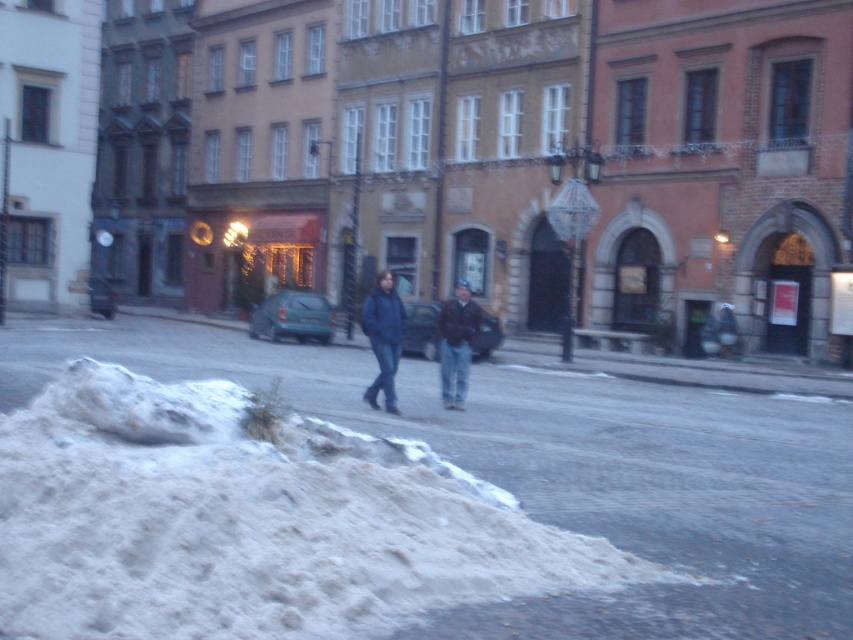
Is matte blue jacket at center smaller than dark brown leather jacket at center?

No.

Which is behind, point (386, 301) or point (456, 355)?

Positioned behind is point (456, 355).

Is point (372, 388) positioned before point (448, 332)?

Yes, point (372, 388) is in front of point (448, 332).

Where is `matte blue jacket at center`? matte blue jacket at center is located at coordinates (383, 337).

Does white powdery snow at lower left appear under dark brown leather jacket at center?

Yes, white powdery snow at lower left is below dark brown leather jacket at center.

Which is more to the right, white powdery snow at lower left or dark brown leather jacket at center?

dark brown leather jacket at center is more to the right.

Does point (312, 436) come in front of point (473, 321)?

That is True.

Locate an element on the screen. This screenshot has height=640, width=853. white powdery snow at lower left is located at coordinates (251, 522).

Based on the photo, does white powdery snow at lower left appear under matte blue jacket at center?

Yes, white powdery snow at lower left is below matte blue jacket at center.

Is white powdery snow at lower left taller than matte blue jacket at center?

In fact, white powdery snow at lower left may be shorter than matte blue jacket at center.

The height and width of the screenshot is (640, 853). What do you see at coordinates (251, 522) in the screenshot? I see `white powdery snow at lower left` at bounding box center [251, 522].

Find the location of a particular element. white powdery snow at lower left is located at coordinates (251, 522).